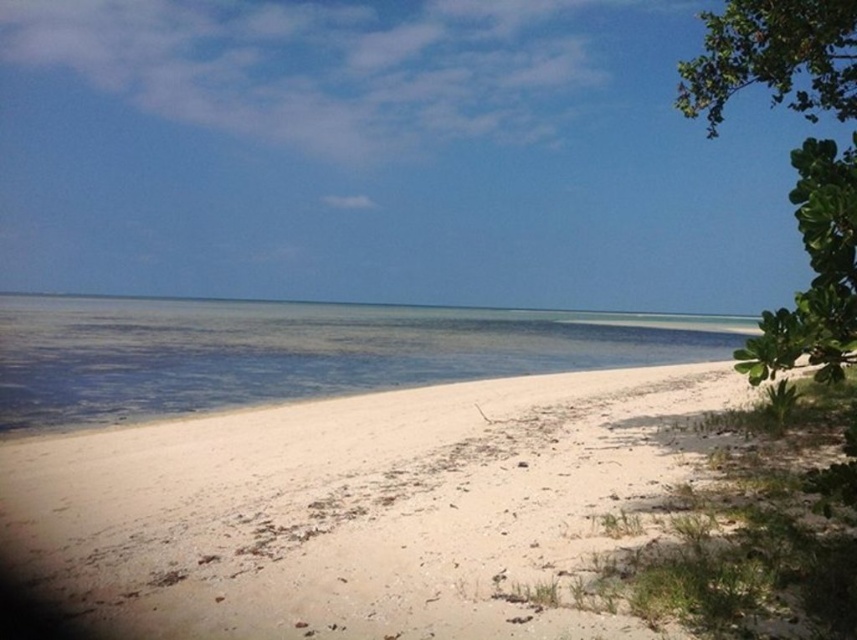
You are standing on the beach and want to reach the clear water at center. Based on the coordinates provided, in which direction should you walk from your current position to reach it?

The clear water at center is located at coordinates point (298,352). Since the coordinate system is not specified, it is recommended to walk towards the center of the beach to reach the clear water at center.

In the scene shown: You are standing on the beach and want to walk to the clear water at center. Which direction should you go from the white sandy beach at lower right?

Since the white sandy beach at lower right is in front of the clear water at center, you should walk towards the clear water at center from the white sandy beach at lower right.